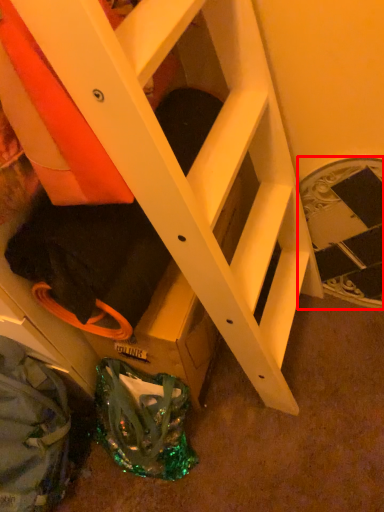
Question: From the image's perspective, where is stairwell (annotated by the red box) located relative to bag?

Choices:
 (A) above
 (B) below

Answer: (A)